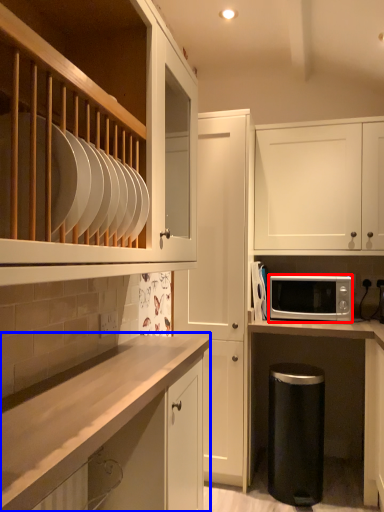
Question: Which of the following is the closest to the observer, microwave oven (highlighted by a red box) or cabinetry (highlighted by a blue box)?

Choices:
 (A) microwave oven
 (B) cabinetry

Answer: (B)